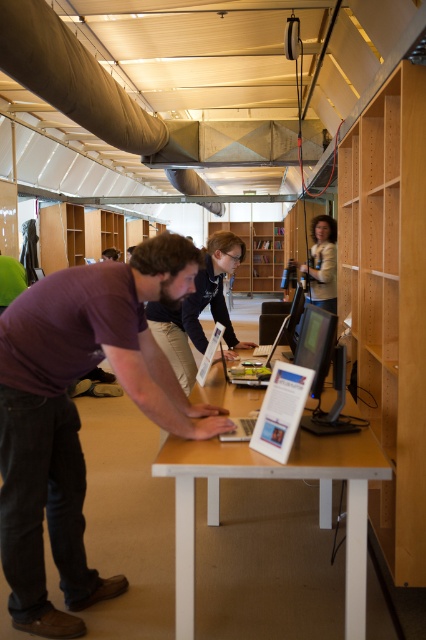
Between point (279, 260) and point (226, 436), which one is positioned in front?

Point (226, 436) is more forward.

Is point (261, 280) less distant than point (333, 333)?

No.

At what (x,y) coordinates should I click in order to perform the action: click on wooden bookshelf at center. Please return your answer as a coordinate pair (x, y). The height and width of the screenshot is (640, 426). Looking at the image, I should click on (258, 256).

Between silver metallic laptop at center and matte black camera at upper center, which one has less height?

Standing shorter between the two is silver metallic laptop at center.

Which is behind, point (302, 330) or point (313, 284)?

The point (313, 284) is behind.

Is point (307, 330) behind point (327, 253)?

No, it is in front of (327, 253).

The height and width of the screenshot is (640, 426). Identify the location of silver metallic laptop at center. (314, 344).

Where is `purple cotton shirt at center`? This screenshot has width=426, height=640. purple cotton shirt at center is located at coordinates (77, 413).